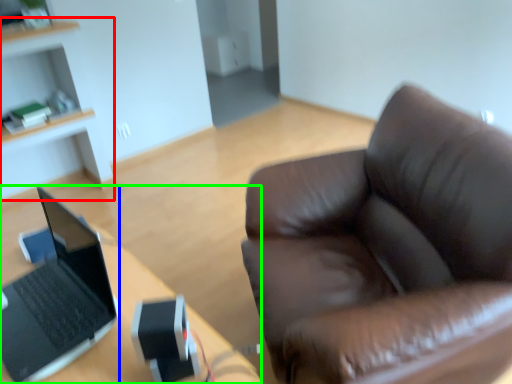
Question: Which is farther away from cabinetry (highlighted by a red box)? laptop (highlighted by a blue box) or desk (highlighted by a green box)?

Choices:
 (A) laptop
 (B) desk

Answer: (A)